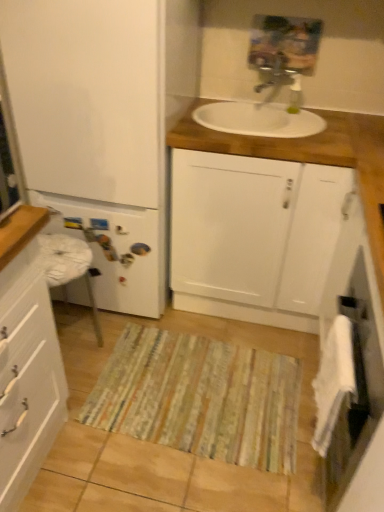
Question: Is point click(x=261, y=64) closer or farther from the camera than point click(x=6, y=306)?

Choices:
 (A) closer
 (B) farther

Answer: (B)

Question: From the image's perspective, is metallic silver faucet at upper center located above or below white glossy cabinet at left, the third bathroom cabinet from the right?

Choices:
 (A) above
 (B) below

Answer: (A)

Question: Which object is positioned farthest from the metallic silver faucet at upper center?

Choices:
 (A) white glossy cabinet at left, which is counted as the 1th bathroom cabinet, starting from the left
 (B) white matte cabinet at center, the 3th bathroom cabinet in the left-to-right sequence
 (C) striped fabric doormat at center
 (D) white fabric towel at right
 (E) white matte refrigerator at left, which is the 2th bathroom cabinet in left-to-right order

Answer: (A)

Question: Which object is positioned farthest from the white matte refrigerator at left, which is the 2th bathroom cabinet in left-to-right order?

Choices:
 (A) white matte cabinet at center, which ranks as the first bathroom cabinet in right-to-left order
 (B) metallic silver faucet at upper center
 (C) white soft towel at lower right
 (D) white glossy cabinet at left, the third bathroom cabinet from the right
 (E) white fabric towel at right

Answer: (C)